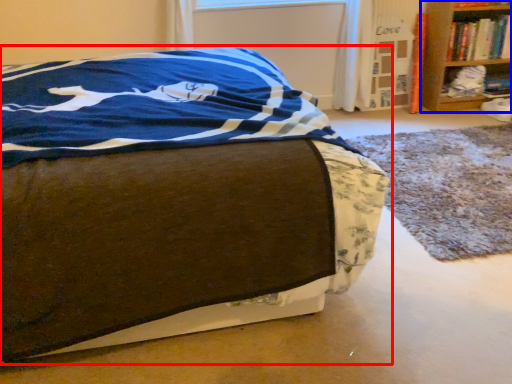
Question: Which object appears closest to the camera in this image, bed (highlighted by a red box) or shelf (highlighted by a blue box)?

Choices:
 (A) bed
 (B) shelf

Answer: (A)